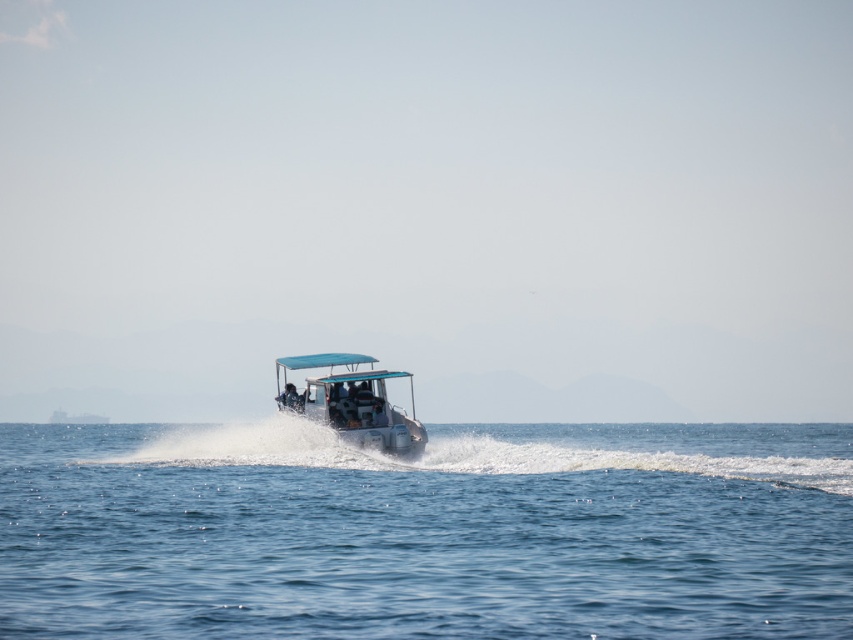
You are a sailor on a ship and need to determine if the blue water at center is within a safe distance from the white plastic boat at center. The safety protocol requires that the distance between them must be at least 100 feet. Based on the image, is the current distance compliant with the safety protocol?

The distance between the blue water at center and the white plastic boat at center is 97.21 feet, which is less than the required 100 feet. Therefore, the current distance does not comply with the safety protocol.

You are a photographer trying to capture the white plastic boat at center from the blue water at center. Which one is closer to the camera?

The blue water at center is in front of the white plastic boat at center, so the blue water at center is closer to the camera.